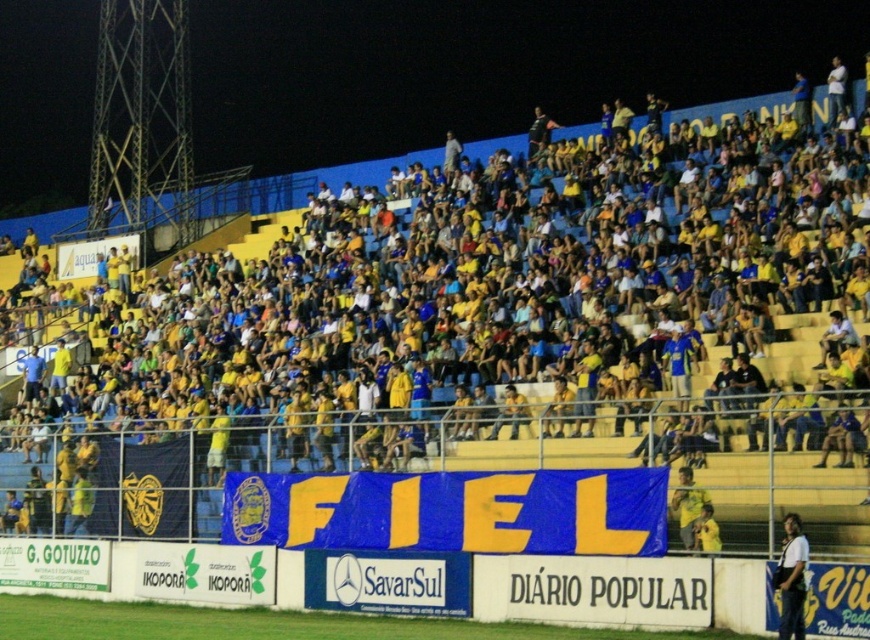
Question: Which point is farther to the camera?

Choices:
 (A) yellow jersey at lower right
 (B) white shirt at lower right

Answer: (A)

Question: Which point is closer to the camera?

Choices:
 (A) [x=807, y=552]
 (B) [x=688, y=522]

Answer: (A)

Question: Where is white shirt at lower right located in relation to yellow jersey at lower right in the image?

Choices:
 (A) below
 (B) above

Answer: (A)

Question: Can you confirm if white shirt at lower right is positioned to the left of yellow jersey at lower right?

Choices:
 (A) no
 (B) yes

Answer: (A)

Question: Can you confirm if white shirt at lower right is smaller than yellow jersey at lower right?

Choices:
 (A) no
 (B) yes

Answer: (A)